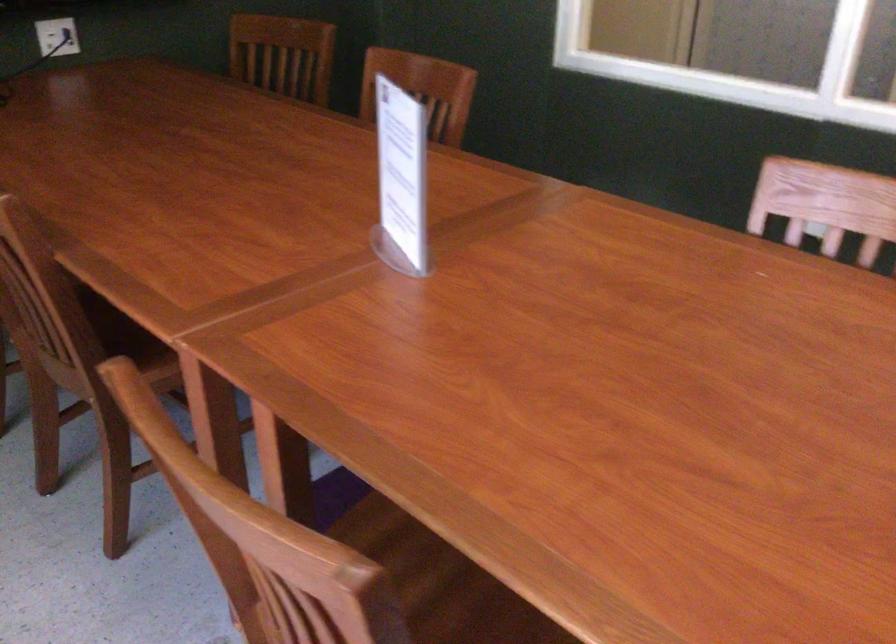
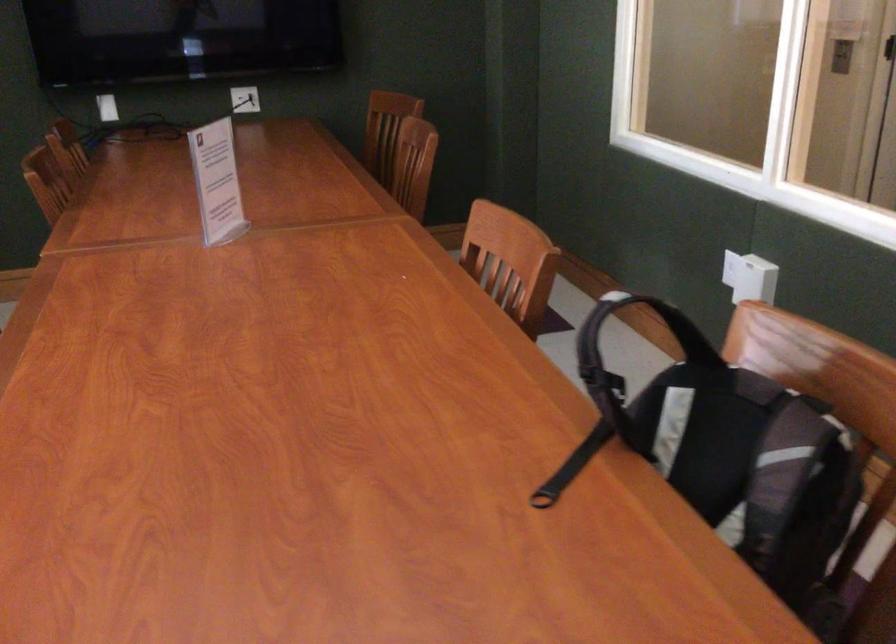
Find the pixel in the second image that matches [386,178] in the first image.

(217, 182)